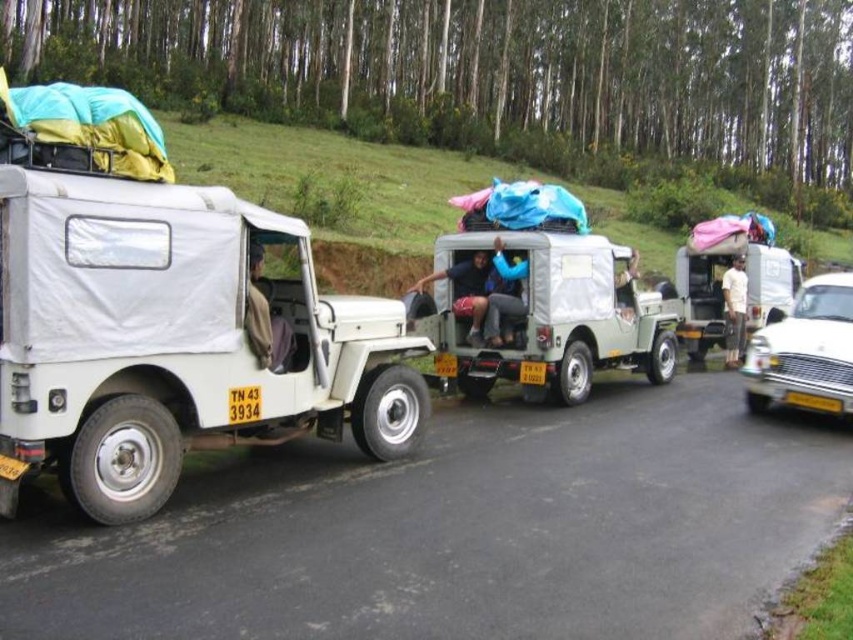
You are a delivery driver who needs to pass under a low bridge that has a height restriction of 2 meters. You are currently driving the white matte trailer truck at left and the green matte pickup truck at center. Which vehicle should you choose to safely pass under the bridge?

The green matte pickup truck at center has a lower height than the white matte trailer truck at left. Since the bridge has a 2 meters height restriction, you should choose the green matte pickup truck at center to safely pass under the bridge.

You are a passenger in the white truck with license plate TN 43 3934. You notice two fabrics inside the truck cabin. One is a brown fabric shirt at left and the other is a light blue fabric at center. Which fabric is taller?

The brown fabric shirt at left is much taller than the light blue fabric at center.